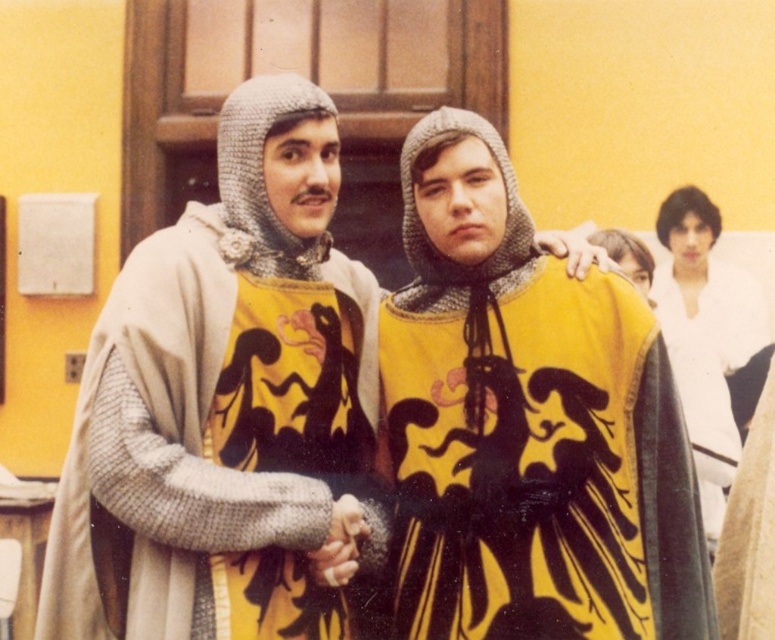
You are organizing a medieval costume event and need to arrange the knitted wool robe at center and the white matte shirt at upper right on a display rack. Based on their positions in the image, which item should be placed higher on the rack to match the original scene?

The white matte shirt at upper right should be placed higher on the rack because in the original scene, the knitted wool robe at center is below it.

You are organizing a medieval fair and need to arrange two props, the knitted wool robe at center and the white matte shirt at upper right, on a display table. The table is 3 meters long. Can both props fit side by side on the table without overlapping?

The knitted wool robe at center and white matte shirt at upper right are 3.45 meters apart from each other. Since the table is only 3 meters long, the props cannot fit side by side without overlapping as the distance between them exceeds the table length.